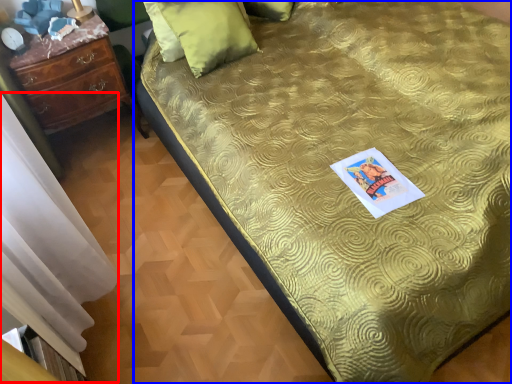
Question: Which object appears farthest to the camera in this image, curtain (highlighted by a red box) or bed (highlighted by a blue box)?

Choices:
 (A) curtain
 (B) bed

Answer: (B)